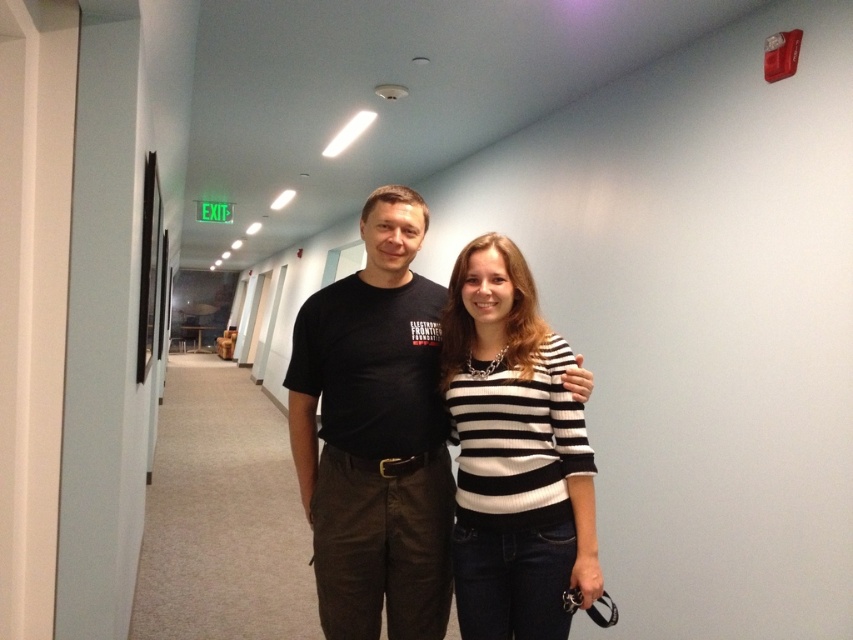
In the scene shown: You are a photographer trying to capture both the black cotton shirt at center and the black and white striped sweater at center in a single frame. Based on their positions, which one is closer to the camera?

The black cotton shirt at center is closer to the camera because the black and white striped sweater at center is behind it.

Where is the black cotton shirt at center located in the image?

The black cotton shirt at center is located at point coordinates of (375, 435).